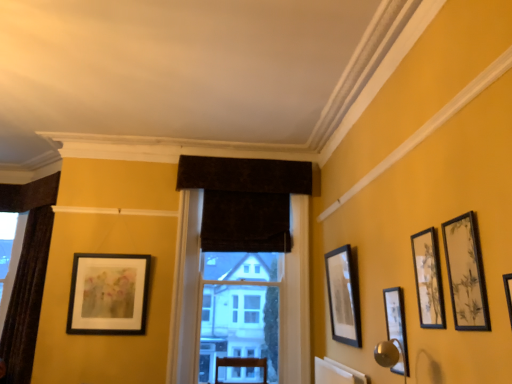
Question: Considering the relative sizes of matte black picture frame at left, which is counted as the first picture frame, starting from the back, and velvet dark brown curtain at center, positioned as the 1th window in right-to-left order, in the image provided, is matte black picture frame at left, which is counted as the first picture frame, starting from the back, wider than velvet dark brown curtain at center, positioned as the 1th window in right-to-left order,?

Choices:
 (A) yes
 (B) no

Answer: (B)

Question: Does matte black picture frame at left, which ranks as the 5th picture frame in front-to-back order, touch velvet dark brown curtain at center, positioned as the 1th window in right-to-left order?

Choices:
 (A) no
 (B) yes

Answer: (A)

Question: From a real-world perspective, is matte black picture frame at left, which is counted as the first picture frame, starting from the back, under velvet dark brown curtain at center, positioned as the 1th window in right-to-left order?

Choices:
 (A) no
 (B) yes

Answer: (B)

Question: Considering the relative positions of matte black picture frame at left, which ranks as the 5th picture frame in front-to-back order, and velvet dark brown curtain at center, which is the 1th window from front to back, in the image provided, is matte black picture frame at left, which ranks as the 5th picture frame in front-to-back order, in front of velvet dark brown curtain at center, which is the 1th window from front to back,?

Choices:
 (A) yes
 (B) no

Answer: (B)

Question: Would you consider matte black picture frame at left, which is counted as the 5th picture frame, starting from the right, to be distant from velvet dark brown curtain at center, positioned as the second window in back-to-front order?

Choices:
 (A) no
 (B) yes

Answer: (A)

Question: Could you tell me if matte black picture frame at left, which is counted as the 5th picture frame, starting from the right, is facing velvet dark brown curtain at center, positioned as the second window in back-to-front order?

Choices:
 (A) no
 (B) yes

Answer: (A)

Question: Could dark velvet curtain at center be considered to be inside matte black picture frame at left, positioned as the first picture frame in left-to-right order?

Choices:
 (A) yes
 (B) no

Answer: (B)

Question: Are matte black picture frame at left, which is counted as the first picture frame, starting from the back, and dark velvet curtain at center making contact?

Choices:
 (A) no
 (B) yes

Answer: (A)

Question: From the image's perspective, is matte black picture frame at left, positioned as the first picture frame in left-to-right order, over dark velvet curtain at center?

Choices:
 (A) yes
 (B) no

Answer: (B)

Question: Is matte black picture frame at left, positioned as the first picture frame in left-to-right order, wider than dark velvet curtain at center?

Choices:
 (A) yes
 (B) no

Answer: (B)

Question: Can you confirm if matte black picture frame at left, which is counted as the 5th picture frame, starting from the right, is bigger than dark velvet curtain at center?

Choices:
 (A) no
 (B) yes

Answer: (A)

Question: Can you confirm if matte black picture frame at left, which is counted as the first picture frame, starting from the back, is positioned to the right of dark velvet curtain at center?

Choices:
 (A) yes
 (B) no

Answer: (B)

Question: Is matte black picture frame at upper right, placed as the first picture frame when sorted from right to left, facing away from matte black picture frame at right, placed as the third picture frame when sorted from right to left?

Choices:
 (A) yes
 (B) no

Answer: (B)